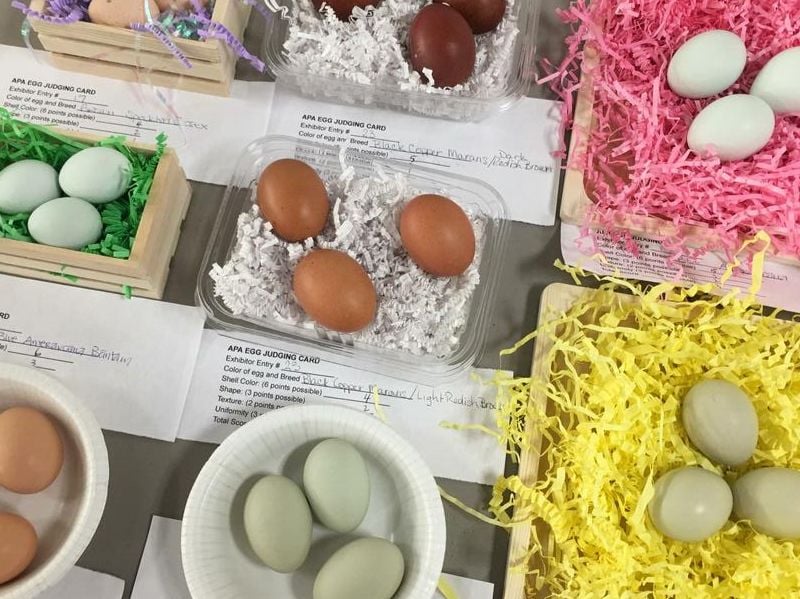
At what (x,y) coordinates should I click in order to perform the action: click on white plate. Please return your answer as a coordinate pair (x, y). The width and height of the screenshot is (800, 599). Looking at the image, I should click on (433, 532).